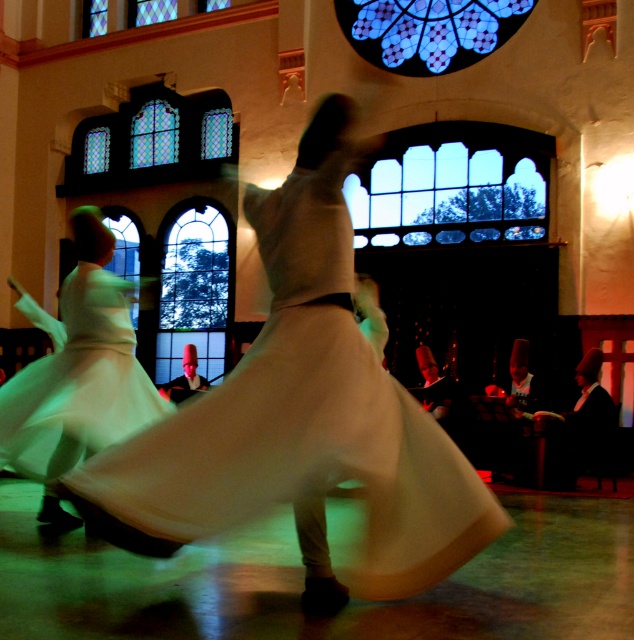
Question: Does white cotton dress at center have a lesser width compared to stained glass window at center?

Choices:
 (A) no
 (B) yes

Answer: (B)

Question: Can you confirm if blue stained glass at upper center is positioned below transparent stained glass at center?

Choices:
 (A) no
 (B) yes

Answer: (A)

Question: Which object appears closest to the camera in this image?

Choices:
 (A) transparent glass window at center
 (B) blue stained glass at upper center
 (C) white sheer dress at center

Answer: (C)

Question: Can you confirm if stained glass window at center is bigger than transparent stained glass at center?

Choices:
 (A) no
 (B) yes

Answer: (B)

Question: Which is nearer to the transparent stained glass at center?

Choices:
 (A) stained glass window at upper left
 (B) transparent glass window at center
 (C) white cotton dress at center
 (D) blue stained glass at upper center

Answer: (B)

Question: Among these objects, which one is nearest to the camera?

Choices:
 (A) stained glass window at center
 (B) stained glass window at upper left
 (C) white cotton dress at center
 (D) transparent glass window at center

Answer: (C)